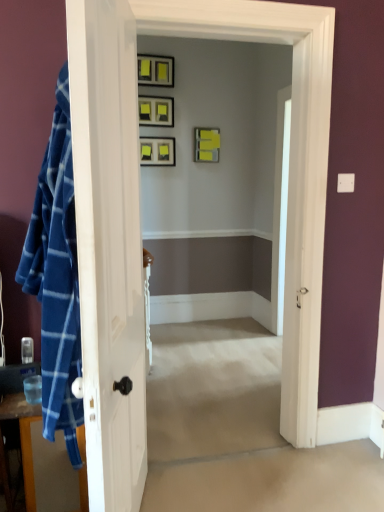
Question: Based on their positions, is matte black picture frame at center, the first picture frame when ordered from bottom to top, located to the left or right of yellow matte picture frame at upper center, the second picture frame from the bottom?

Choices:
 (A) right
 (B) left

Answer: (B)

Question: Is matte black picture frame at center, marked as the 4th picture frame in a top-to-bottom arrangement, taller or shorter than yellow matte picture frame at upper center, the second picture frame from the bottom?

Choices:
 (A) tall
 (B) short

Answer: (B)

Question: Which of these objects is positioned farthest from the yellow matte picture frame at upper center, the second picture frame from the bottom?

Choices:
 (A) matte black picture frame at upper center, the third picture frame positioned from the bottom
 (B) blue plaid fabric at left
 (C) matte black picture frame at center, marked as the 4th picture frame in a top-to-bottom arrangement
 (D) matte black picture frame at upper center, marked as the 4th picture frame in a bottom-to-top arrangement

Answer: (B)

Question: Which of these objects is positioned farthest from the yellow matte picture frame at upper center, the 3th picture frame in the top-to-bottom sequence?

Choices:
 (A) matte black picture frame at upper center, marked as the 4th picture frame in a bottom-to-top arrangement
 (B) matte black picture frame at center, marked as the 4th picture frame in a top-to-bottom arrangement
 (C) matte black picture frame at upper center, arranged as the second picture frame when viewed from the top
 (D) blue plaid fabric at left

Answer: (D)